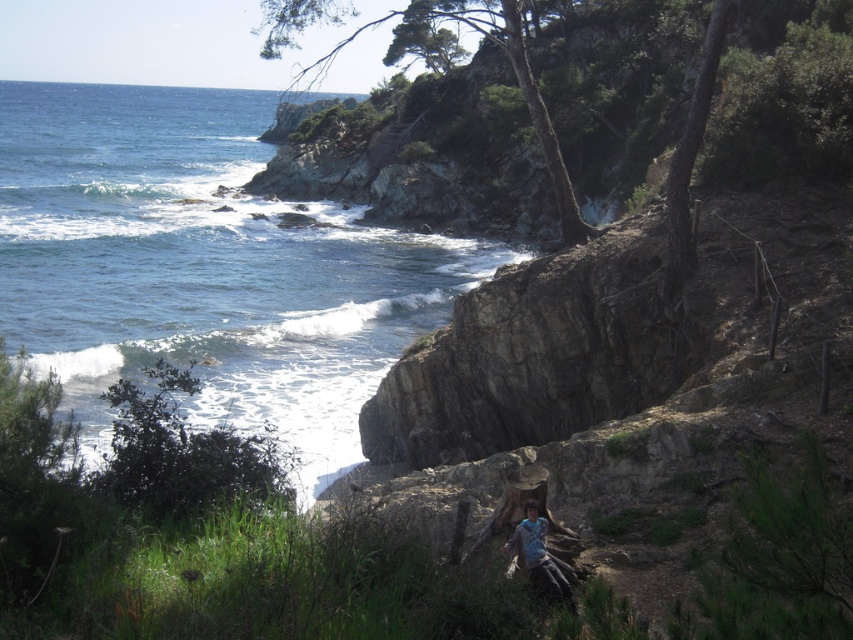
You are a photographer standing on the rocky cliffside. You want to capture a photo of the blue denim jeans at lower center without the blue water at lower left blocking it. What should you do?

Move to the right side of the scene so that the blue denim jeans at lower center is no longer behind the blue water at lower left.

You are standing at the base of the cliff where the person is sitting. You want to walk towards the point marked at coordinates (x=202, y=268). Which direction should you head?

The point marked at coordinates (x=202, y=268) is located on the blue water at lower left, so you should head towards the lower left direction from your current position at the base of the cliff.